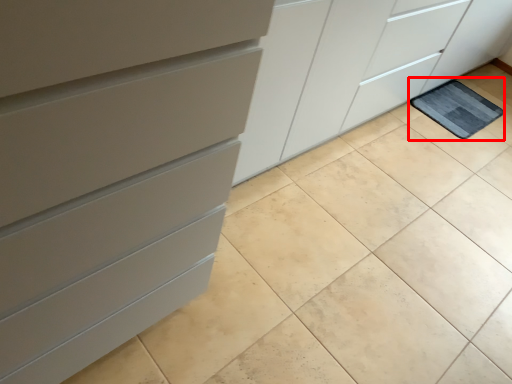
Question: Observing the image, what is the correct spatial positioning of bath mat (annotated by the red box) in reference to chest of drawers?

Choices:
 (A) right
 (B) left

Answer: (A)